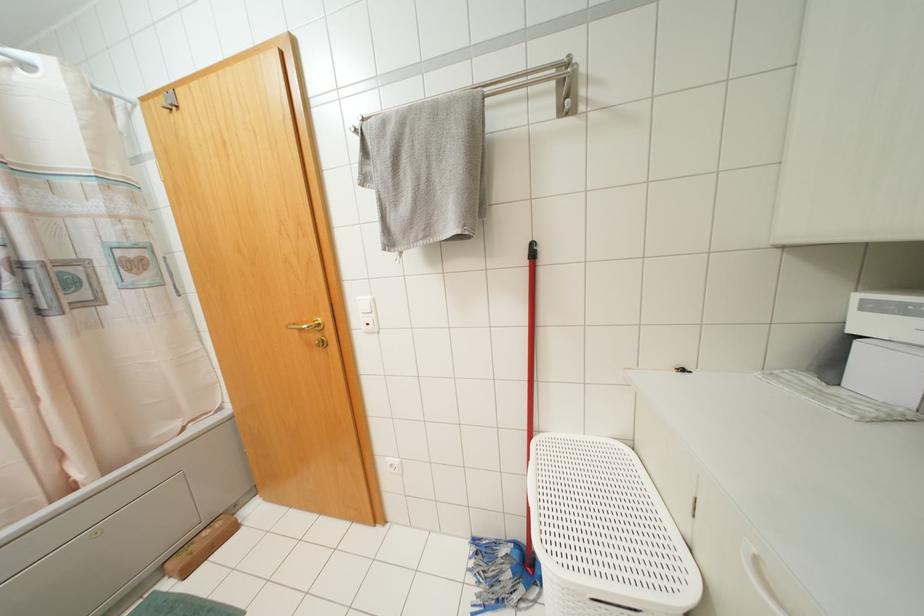
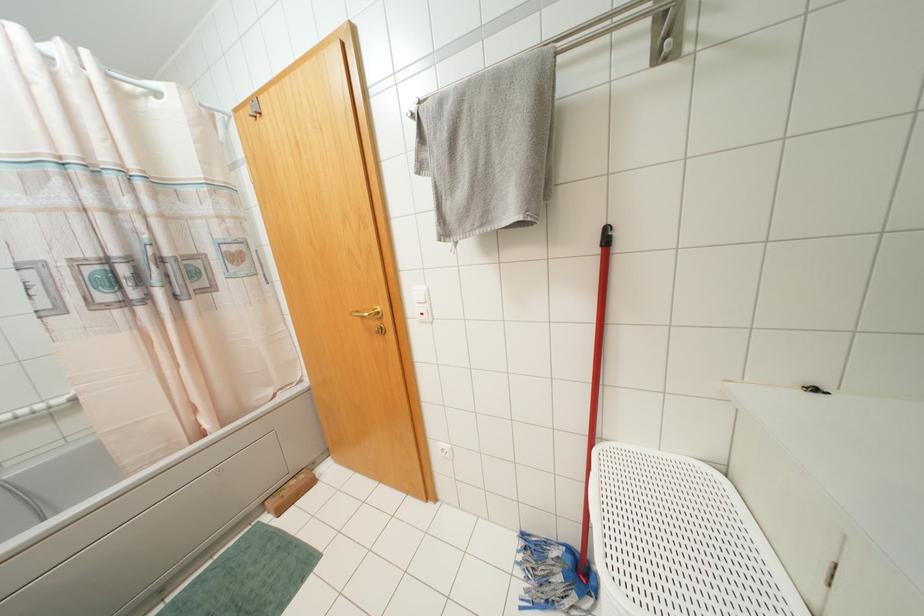
The point at (x=162, y=100) is marked in the first image. Where is the corresponding point in the second image?

(249, 110)